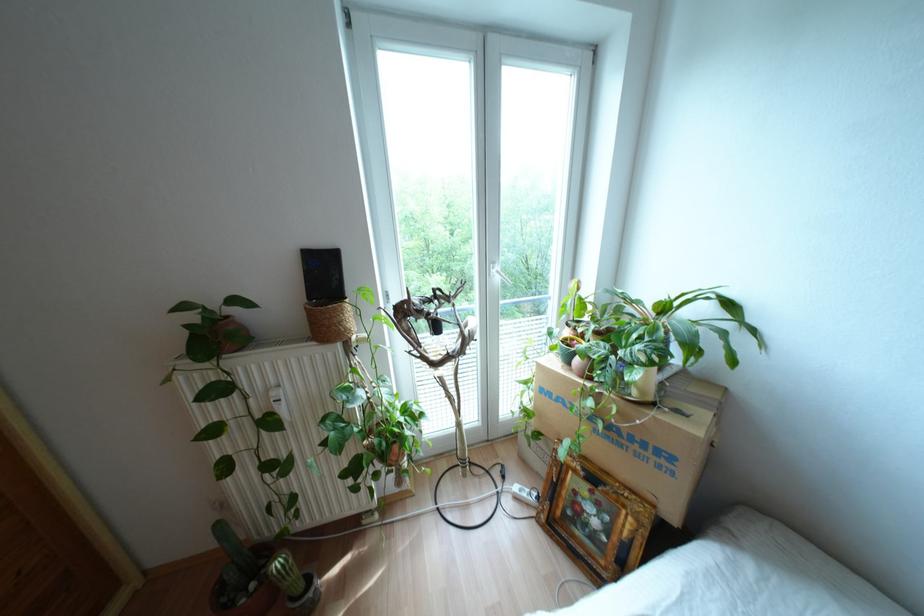
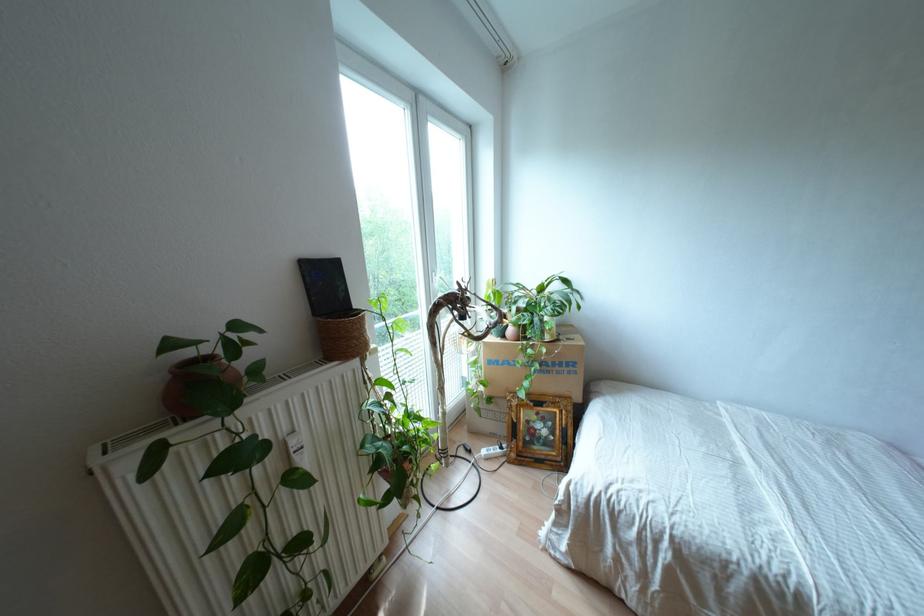
Find the pixel in the second image that matches (x=532, y=498) in the first image.

(497, 450)